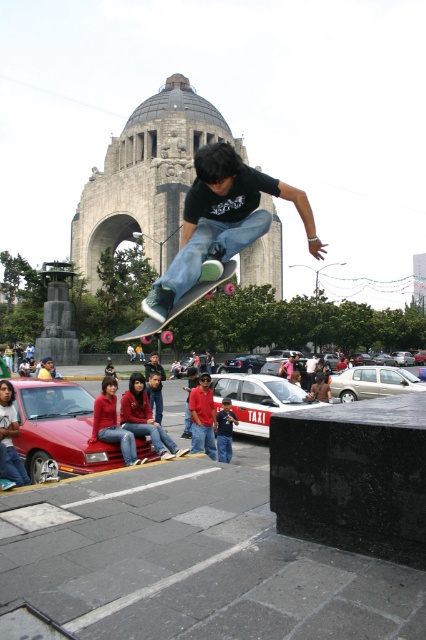
Question: Can you confirm if matte black skateboard at center is positioned to the left of pink rubber wheels skateboard at center?

Choices:
 (A) yes
 (B) no

Answer: (B)

Question: Which point is farther from the camera taking this photo?

Choices:
 (A) (189, 296)
 (B) (218, 458)
 (C) (198, 394)

Answer: (C)

Question: Is red cotton shirt at center positioned at the back of pink rubber wheels skateboard at center?

Choices:
 (A) no
 (B) yes

Answer: (B)

Question: Can you confirm if matte black skateboard at center is wider than pink rubber wheels skateboard at center?

Choices:
 (A) no
 (B) yes

Answer: (B)

Question: Considering the real-world distances, which object is closest to the matte black skateboard at center?

Choices:
 (A) red cotton shirt at center
 (B) pink rubber wheels skateboard at center

Answer: (B)

Question: Among these objects, which one is nearest to the camera?

Choices:
 (A) matte black skateboard at center
 (B) blue denim jeans at center
 (C) red cotton shirt at center
 (D) pink rubber wheels skateboard at center

Answer: (D)